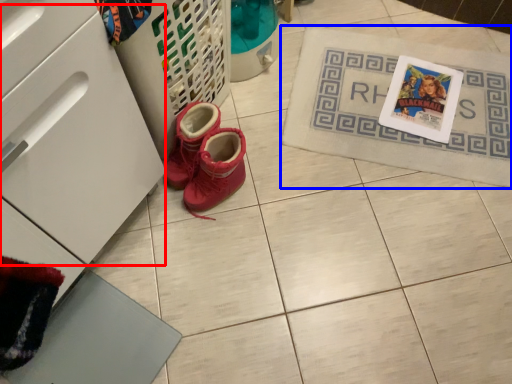
Question: Which of the following is the farthest to the observer, drawer (highlighted by a red box) or bath mat (highlighted by a blue box)?

Choices:
 (A) drawer
 (B) bath mat

Answer: (B)